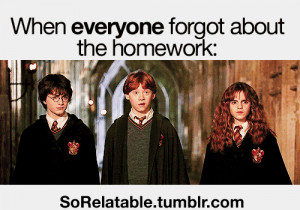
Find the location of a particular element. Image resolution: width=300 pixels, height=210 pixels. archway is located at coordinates (117, 89).